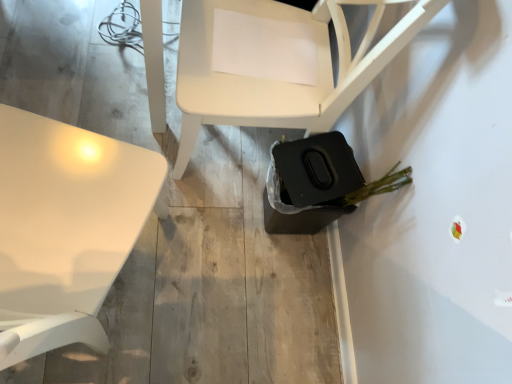
The image size is (512, 384). Identify the location of vacant space behind white glossy table at upper left. (127, 126).